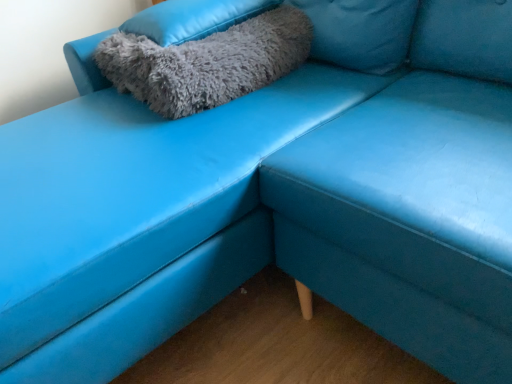
Question: Can you confirm if gray fluffy pillow at upper left, the 1th pillow viewed from the top, is wider than gray fluffy pillow at upper left, which is the first pillow from bottom to top?

Choices:
 (A) no
 (B) yes

Answer: (B)

Question: Is gray fluffy pillow at upper left, the 1th pillow viewed from the top, surrounding gray fluffy pillow at upper left, which ranks as the 2th pillow in top-to-bottom order?

Choices:
 (A) no
 (B) yes

Answer: (A)

Question: Is gray fluffy pillow at upper left, the 1th pillow viewed from the top, at the right side of gray fluffy pillow at upper left, which is the first pillow from bottom to top?

Choices:
 (A) no
 (B) yes

Answer: (B)

Question: Is gray fluffy pillow at upper left, which ranks as the second pillow in bottom-to-top order, facing towards gray fluffy pillow at upper left, which is the first pillow from bottom to top?

Choices:
 (A) yes
 (B) no

Answer: (B)

Question: Considering the relative sizes of gray fluffy pillow at upper left, which ranks as the second pillow in bottom-to-top order, and gray fluffy pillow at upper left, which ranks as the 2th pillow in top-to-bottom order, in the image provided, is gray fluffy pillow at upper left, which ranks as the second pillow in bottom-to-top order, smaller than gray fluffy pillow at upper left, which ranks as the 2th pillow in top-to-bottom order,?

Choices:
 (A) no
 (B) yes

Answer: (B)

Question: From a real-world perspective, is gray fluffy pillow at upper left, which ranks as the second pillow in bottom-to-top order, physically above gray fluffy pillow at upper left, which is the first pillow from bottom to top?

Choices:
 (A) yes
 (B) no

Answer: (A)

Question: Can you confirm if gray fluffy pillow at upper left, which ranks as the 2th pillow in top-to-bottom order, is shorter than gray fluffy pillow at upper left, which ranks as the second pillow in bottom-to-top order?

Choices:
 (A) no
 (B) yes

Answer: (A)

Question: Is gray fluffy pillow at upper left, which ranks as the 2th pillow in top-to-bottom order, closer to the viewer compared to gray fluffy pillow at upper left, which ranks as the second pillow in bottom-to-top order?

Choices:
 (A) yes
 (B) no

Answer: (A)

Question: Is gray fluffy pillow at upper left, which ranks as the 2th pillow in top-to-bottom order, far from gray fluffy pillow at upper left, which ranks as the second pillow in bottom-to-top order?

Choices:
 (A) no
 (B) yes

Answer: (A)

Question: Considering the relative sizes of gray fluffy pillow at upper left, which ranks as the 2th pillow in top-to-bottom order, and gray fluffy pillow at upper left, the 1th pillow viewed from the top, in the image provided, is gray fluffy pillow at upper left, which ranks as the 2th pillow in top-to-bottom order, taller than gray fluffy pillow at upper left, the 1th pillow viewed from the top,?

Choices:
 (A) no
 (B) yes

Answer: (B)

Question: From the image's perspective, would you say gray fluffy pillow at upper left, which ranks as the 2th pillow in top-to-bottom order, is shown under gray fluffy pillow at upper left, which ranks as the second pillow in bottom-to-top order?

Choices:
 (A) no
 (B) yes

Answer: (B)

Question: From a real-world perspective, is gray fluffy pillow at upper left, which ranks as the 2th pillow in top-to-bottom order, physically below gray fluffy pillow at upper left, the 1th pillow viewed from the top?

Choices:
 (A) no
 (B) yes

Answer: (B)

Question: Is point tap(140, 56) closer or farther from the camera than point tap(151, 14)?

Choices:
 (A) closer
 (B) farther

Answer: (A)